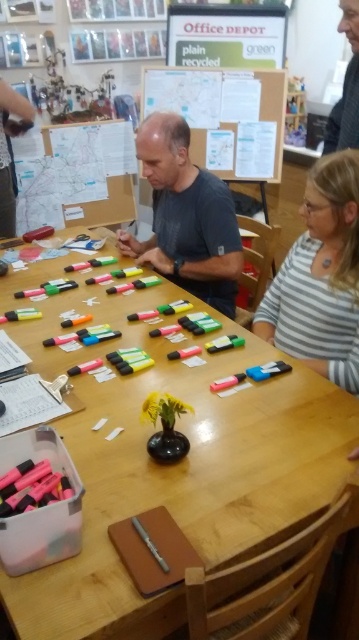
Which is above, white paperboard at upper center or matte black marker at upper left?

white paperboard at upper center

Find the location of a particular element. The image size is (359, 640). white paperboard at upper center is located at coordinates (222, 113).

Which is in front, point (343, 253) or point (357, 72)?

Point (343, 253) is in front.

Can you confirm if white striped shirt at upper right is positioned above matte black shirt at upper right?

No.

Does point (356, 154) come behind point (353, 51)?

That is False.

Identify the location of white striped shirt at upper right. The image size is (359, 640). (320, 276).

Is dark gray shirt at center taller than matte black shirt at upper right?

Yes.

From the picture: Who is more distant from viewer, [175,188] or [355,93]?

The point [355,93] is behind.

This screenshot has width=359, height=640. I want to click on dark gray shirt at center, so click(x=185, y=216).